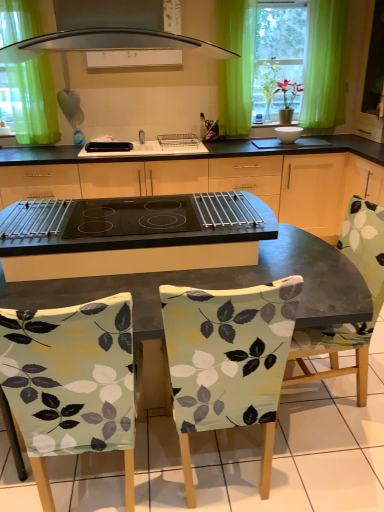
Describe the element at coordinates (354, 323) in the screenshot. I see `printed fabric chair at center, which is the 3th chair in left-to-right order` at that location.

What are the coordinates of `light green fabric chair at lower left, marked as the third chair in a right-to-left arrangement` in the screenshot? It's located at (72, 383).

What do you see at coordinates (72, 383) in the screenshot?
I see `light green fabric chair at lower left, which is the 1th chair in left-to-right order` at bounding box center [72, 383].

Looking at this image, how much space does green fabric curtain at upper left, which is counted as the 1th curtain, starting from the left, occupy horizontally?

It is 6.55 inches.

Find the location of `black plastic toaster at center, placed as the 1th appliance when sorted from left to right`. black plastic toaster at center, placed as the 1th appliance when sorted from left to right is located at coordinates (108, 146).

At what (x,y) coordinates should I click in order to perform the action: click on printed fabric chair at center, which is the 3th chair in left-to-right order. Please return your answer as a coordinate pair (x, y). This screenshot has width=384, height=512. Looking at the image, I should click on (354, 323).

In the scene shown: Does green fabric curtain at upper left, which is counted as the 1th curtain, starting from the left, have a smaller size compared to printed fabric chair at center, which is the 3th chair in left-to-right order?

Correct, green fabric curtain at upper left, which is counted as the 1th curtain, starting from the left, occupies less space than printed fabric chair at center, which is the 3th chair in left-to-right order.

Which object is thinner, green fabric curtain at upper left, which is counted as the 1th curtain, starting from the left, or printed fabric chair at center, the 1th chair viewed from the right?

Thinner between the two is green fabric curtain at upper left, which is counted as the 1th curtain, starting from the left.

Starting from the printed fabric chair at center, which is the 3th chair in left-to-right order, which curtain is the 1st one behind? Please provide its 2D coordinates.

[(33, 101)]

Looking at this image, from a real-world perspective, who is located lower, green fabric curtain at upper left, which is counted as the 1th curtain, starting from the left, or printed fabric chair at center, the 1th chair viewed from the right?

printed fabric chair at center, the 1th chair viewed from the right, from a real-world perspective.

Is the depth of white glossy sink at center greater than that of green sheer curtain at upper center, which ranks as the 2th curtain in left-to-right order?

No, white glossy sink at center is closer to the viewer.

Is white glossy sink at center oriented away from green sheer curtain at upper center, which ranks as the 2th curtain in left-to-right order?

No, green sheer curtain at upper center, which ranks as the 2th curtain in left-to-right order, is not at the back of white glossy sink at center.

Is white glossy sink at center taller or shorter than green sheer curtain at upper center, which appears as the first curtain when viewed from the right?

In the image, white glossy sink at center appears to be shorter than green sheer curtain at upper center, which appears as the first curtain when viewed from the right.

Is green sheer curtain at upper center, which appears as the first curtain when viewed from the right, to the left or to the right of printed fabric chair at center, which is the 3th chair in left-to-right order, in the image?

From the image, it's evident that green sheer curtain at upper center, which appears as the first curtain when viewed from the right, is to the left of printed fabric chair at center, which is the 3th chair in left-to-right order.

Which object is closer to the camera taking this photo, green sheer curtain at upper center, which ranks as the 2th curtain in left-to-right order, or printed fabric chair at center, which is the 3th chair in left-to-right order?

printed fabric chair at center, which is the 3th chair in left-to-right order, is closer to the camera.

Is green sheer curtain at upper center, which ranks as the 2th curtain in left-to-right order, facing away from printed fabric chair at center, which is the 3th chair in left-to-right order?

No, green sheer curtain at upper center, which ranks as the 2th curtain in left-to-right order, is not facing away from printed fabric chair at center, which is the 3th chair in left-to-right order.

Which point is more forward, [253,62] or [321,336]?

Point [321,336]

Can you confirm if black glass cooktop at center is shorter than patterned fabric chair at center, which is counted as the second chair, starting from the left?

Yes.

Visually, is black glass cooktop at center positioned to the left or to the right of patterned fabric chair at center, acting as the second chair starting from the right?

Based on their positions, black glass cooktop at center is located to the left of patterned fabric chair at center, acting as the second chair starting from the right.

In the scene shown: Is black glass cooktop at center oriented away from patterned fabric chair at center, acting as the second chair starting from the right?

That's not correct — black glass cooktop at center is not looking away from patterned fabric chair at center, acting as the second chair starting from the right.

Is printed fabric chair at center, which is the 3th chair in left-to-right order, positioned with its back to white glossy bowl at center, which is the 1th appliance from right to left?

No, printed fabric chair at center, which is the 3th chair in left-to-right order, is not facing away from white glossy bowl at center, which is the 1th appliance from right to left.

Image resolution: width=384 pixels, height=512 pixels. I want to click on chair that is the 1st object located below the white glossy bowl at center, which is the 1th appliance from right to left (from the image's perspective), so click(x=354, y=323).

Which object is thinner, printed fabric chair at center, which is the 3th chair in left-to-right order, or white glossy bowl at center, which is the 1th appliance from right to left?

white glossy bowl at center, which is the 1th appliance from right to left.

Is the depth of printed fabric chair at center, the 1th chair viewed from the right, less than that of white glossy bowl at center, which is the 1th appliance from right to left?

Yes, printed fabric chair at center, the 1th chair viewed from the right, is closer to the viewer.

What's the angular difference between green sheer curtain at upper center, which appears as the first curtain when viewed from the right, and white glossy sink at center's facing directions?

There is a 0.531-degree angle between the facing directions of green sheer curtain at upper center, which appears as the first curtain when viewed from the right, and white glossy sink at center.

From a real-world perspective, is green sheer curtain at upper center, which ranks as the 2th curtain in left-to-right order, positioned under white glossy sink at center based on gravity?

No, from a real-world perspective, green sheer curtain at upper center, which ranks as the 2th curtain in left-to-right order, is not beneath white glossy sink at center.

Which object is further away from the camera taking this photo, green sheer curtain at upper center, which appears as the first curtain when viewed from the right, or white glossy sink at center?

green sheer curtain at upper center, which appears as the first curtain when viewed from the right.

Find the location of `sink on the left of the green sheer curtain at upper center, which ranks as the 2th curtain in left-to-right order`. sink on the left of the green sheer curtain at upper center, which ranks as the 2th curtain in left-to-right order is located at coordinates (156, 147).

Is printed fabric chair at center, which is the 3th chair in left-to-right order, looking in the opposite direction of white glossy sink at center?

No, printed fabric chair at center, which is the 3th chair in left-to-right order,'s orientation is not away from white glossy sink at center.

Is printed fabric chair at center, which is the 3th chair in left-to-right order, wider or thinner than white glossy sink at center?

In the image, printed fabric chair at center, which is the 3th chair in left-to-right order, appears to be wider than white glossy sink at center.

How many degrees apart are the facing directions of printed fabric chair at center, the 1th chair viewed from the right, and white glossy sink at center?

83.5 degrees separate the facing orientations of printed fabric chair at center, the 1th chair viewed from the right, and white glossy sink at center.

Which chair is the 1st one when counting from the front of the green fabric curtain at upper left, the 2th curtain in the right-to-left sequence? Please provide its 2D coordinates.

[(354, 323)]

The image size is (384, 512). In order to click on curtain on the right of the white glossy sink at center in this screenshot , I will do `click(236, 65)`.

When comparing their distances from printed fabric chair at center, the 1th chair viewed from the right, does black plastic toaster at center, the second appliance from the right, or white glossy sink at center seem further?

black plastic toaster at center, the second appliance from the right, lies further to printed fabric chair at center, the 1th chair viewed from the right, than the other object.

From the image, which object appears to be farther from black plastic toaster at center, the second appliance from the right, green fabric curtain at upper left, the 2th curtain in the right-to-left sequence, or light green fabric chair at lower left, which is the 1th chair in left-to-right order?

Based on the image, light green fabric chair at lower left, which is the 1th chair in left-to-right order, appears to be further to black plastic toaster at center, the second appliance from the right.

Based on the photo, when comparing their distances from green fabric curtain at upper left, the 2th curtain in the right-to-left sequence, does black plastic toaster at center, placed as the 1th appliance when sorted from left to right, or patterned fabric chair at center, acting as the second chair starting from the right, seem further?

patterned fabric chair at center, acting as the second chair starting from the right, lies further to green fabric curtain at upper left, the 2th curtain in the right-to-left sequence, than the other object.

When comparing their distances from white glossy sink at center, does black glass cooktop at center or patterned fabric chair at center, acting as the second chair starting from the right, seem closer?

Result: The object closer to white glossy sink at center is black glass cooktop at center.

Estimate the real-world distances between objects in this image. Which object is further from green sheer curtain at upper center, which appears as the first curtain when viewed from the right, white glossy sink at center or patterned fabric chair at center, acting as the second chair starting from the right?

Based on the image, patterned fabric chair at center, acting as the second chair starting from the right, appears to be further to green sheer curtain at upper center, which appears as the first curtain when viewed from the right.

Based on their spatial positions, is black plastic toaster at center, the second appliance from the right, or white glossy sink at center further from green sheer curtain at upper center, which appears as the first curtain when viewed from the right?

Among the two, black plastic toaster at center, the second appliance from the right, is located further to green sheer curtain at upper center, which appears as the first curtain when viewed from the right.

Looking at the image, which one is located closer to black plastic toaster at center, placed as the 1th appliance when sorted from left to right, green sheer curtain at upper center, which ranks as the 2th curtain in left-to-right order, or light green fabric chair at lower left, which is the 1th chair in left-to-right order?

The object closer to black plastic toaster at center, placed as the 1th appliance when sorted from left to right, is green sheer curtain at upper center, which ranks as the 2th curtain in left-to-right order.

When comparing their distances from green fabric curtain at upper left, which is counted as the 1th curtain, starting from the left, does patterned fabric chair at center, which is counted as the second chair, starting from the left, or printed fabric chair at center, the 1th chair viewed from the right, seem closer?

printed fabric chair at center, the 1th chair viewed from the right.

At what (x,y) coordinates should I click in order to perform the action: click on cabinetry positioned between light green fabric chair at lower left, which is the 1th chair in left-to-right order, and green fabric curtain at upper left, which is counted as the 1th curtain, starting from the left, from near to far. Please return your answer as a coordinate pair (x, y). The image size is (384, 512). Looking at the image, I should click on (220, 183).

Where is `cabinetry between patterned fabric chair at center, acting as the second chair starting from the right, and white glossy bowl at center, positioned as the 2th appliance in left-to-right order, in the front-back direction`? The height and width of the screenshot is (512, 384). cabinetry between patterned fabric chair at center, acting as the second chair starting from the right, and white glossy bowl at center, positioned as the 2th appliance in left-to-right order, in the front-back direction is located at coordinates (220, 183).

Where is `chair between patterned fabric chair at center, which is counted as the second chair, starting from the left, and white glossy bowl at center, positioned as the 2th appliance in left-to-right order, in the front-back direction`? The width and height of the screenshot is (384, 512). chair between patterned fabric chair at center, which is counted as the second chair, starting from the left, and white glossy bowl at center, positioned as the 2th appliance in left-to-right order, in the front-back direction is located at coordinates (354, 323).

This screenshot has width=384, height=512. What are the coordinates of `sink between green sheer curtain at upper center, which ranks as the 2th curtain in left-to-right order, and black glass cooktop at center in the up-down direction` in the screenshot? It's located at (156, 147).